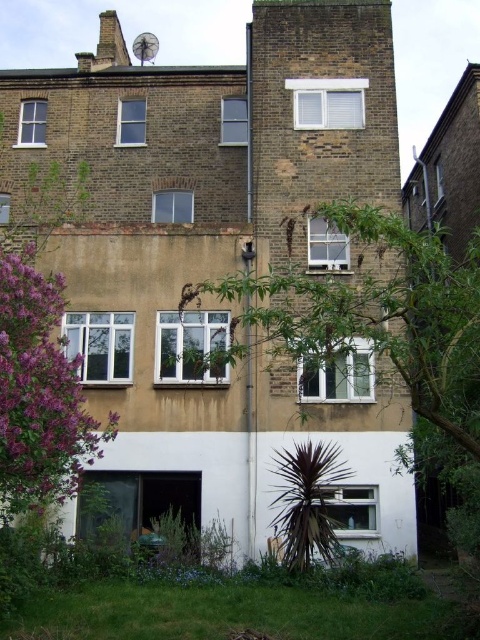
Between green leafy tree at center and purple leafy tree at lower left, which one appears on the left side from the viewer's perspective?

Positioned to the left is purple leafy tree at lower left.

The width and height of the screenshot is (480, 640). I want to click on green leafy tree at center, so [377, 314].

Is point (316, 310) farther from camera compared to point (61, 310)?

No, it is in front of (61, 310).

I want to click on green leafy tree at center, so click(377, 314).